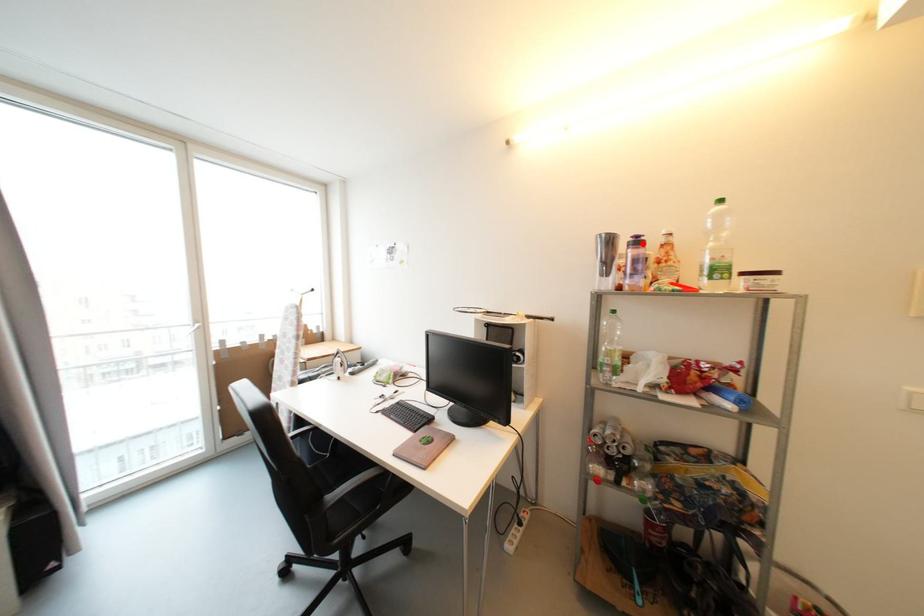
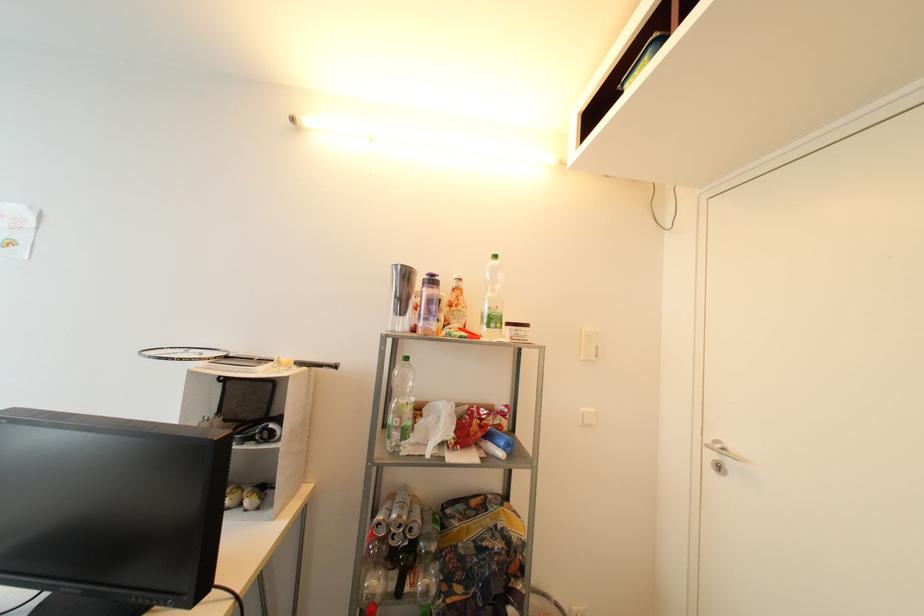
Question: I am providing you with two images of the same scene from different viewpoints. A red point is marked on the first image. Can you still see the location of the red point in image 2?

Choices:
 (A) Yes
 (B) No

Answer: (A)